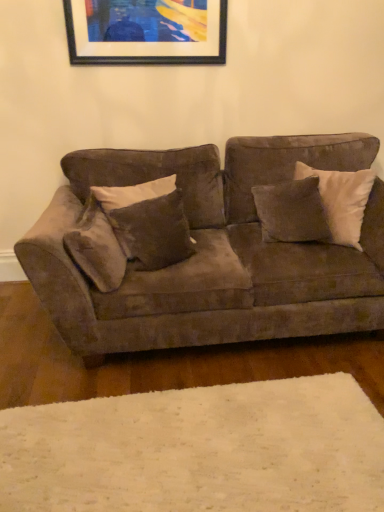
Where is `blank space situated above white soft rug at lower center (from a real-world perspective)`? blank space situated above white soft rug at lower center (from a real-world perspective) is located at coordinates (184, 455).